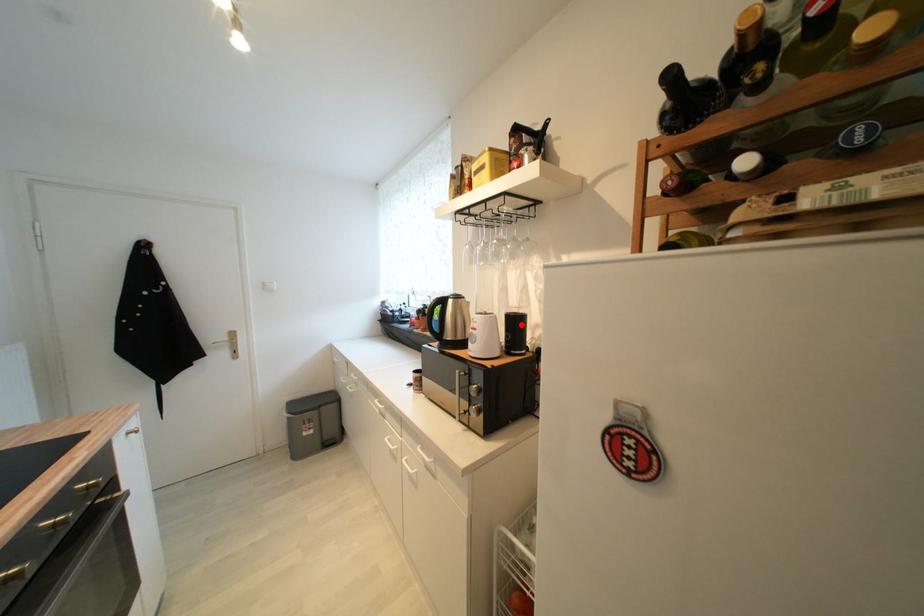
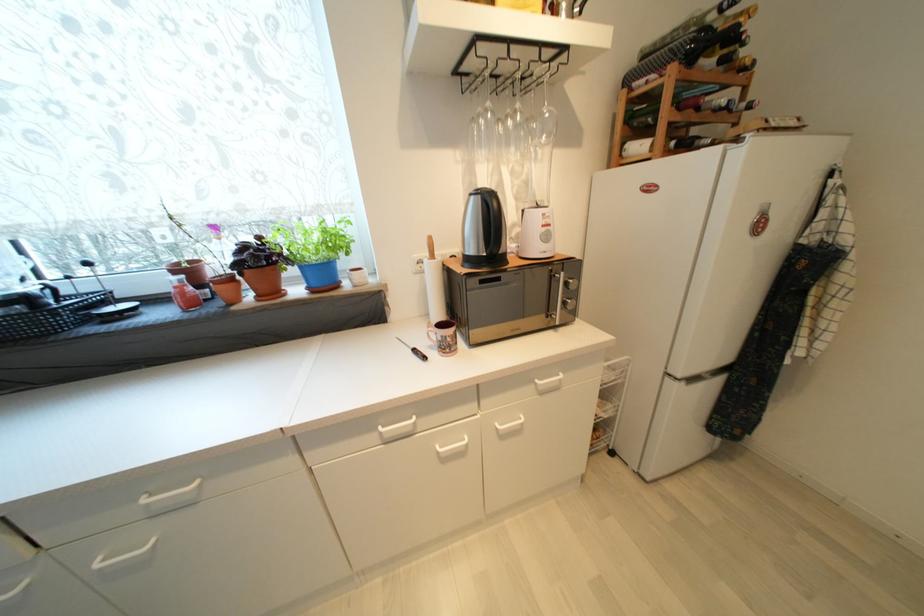
Question: I am providing you with two images of the same scene from different viewpoints. A red point is marked on the first image. Can you still see the location of the red point in image 2?

Choices:
 (A) Yes
 (B) No

Answer: (B)